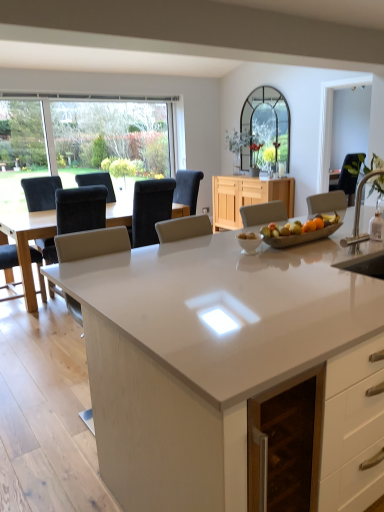
Question: From a real-world perspective, is matte black chair at left, positioned as the third chair in right-to-left order, beneath light wood cabinet at center?

Choices:
 (A) no
 (B) yes

Answer: (A)

Question: Is matte black chair at left, the 2th chair when ordered from left to right, taller than light wood cabinet at center?

Choices:
 (A) yes
 (B) no

Answer: (A)

Question: From a real-world perspective, does matte black chair at left, positioned as the third chair in right-to-left order, stand above light wood cabinet at center?

Choices:
 (A) no
 (B) yes

Answer: (B)

Question: Does matte black chair at left, positioned as the third chair in right-to-left order, have a smaller size compared to light wood cabinet at center?

Choices:
 (A) no
 (B) yes

Answer: (B)

Question: Is matte black chair at left, positioned as the third chair in right-to-left order, at the left side of light wood cabinet at center?

Choices:
 (A) yes
 (B) no

Answer: (A)

Question: Is black fabric chair at right, which ranks as the 4th chair in left-to-right order, situated inside white glossy countertop at center or outside?

Choices:
 (A) outside
 (B) inside

Answer: (A)

Question: From the image's perspective, is black fabric chair at right, which is the 1th chair from right to left, above or below white glossy countertop at center?

Choices:
 (A) below
 (B) above

Answer: (B)

Question: Considering their positions, is black fabric chair at right, which ranks as the 4th chair in left-to-right order, located in front of or behind white glossy countertop at center?

Choices:
 (A) front
 (B) behind

Answer: (B)

Question: Is black fabric chair at right, which is the 1th chair from right to left, bigger or smaller than white glossy countertop at center?

Choices:
 (A) small
 (B) big

Answer: (A)

Question: In terms of width, does white glossy countertop at center look wider or thinner when compared to satin nickel faucet at right?

Choices:
 (A) wide
 (B) thin

Answer: (A)

Question: Does point (104, 397) appear closer or farther from the camera than point (359, 259)?

Choices:
 (A) closer
 (B) farther

Answer: (A)

Question: In the image, is white glossy countertop at center positioned in front of or behind satin nickel faucet at right?

Choices:
 (A) behind
 (B) front

Answer: (B)

Question: From a real-world perspective, is white glossy countertop at center physically located above or below satin nickel faucet at right?

Choices:
 (A) above
 (B) below

Answer: (B)

Question: From a real-world perspective, is light wood cabinet at center positioned above or below white glossy countertop at center?

Choices:
 (A) below
 (B) above

Answer: (B)

Question: Does point (281, 198) appear closer or farther from the camera than point (122, 465)?

Choices:
 (A) closer
 (B) farther

Answer: (B)